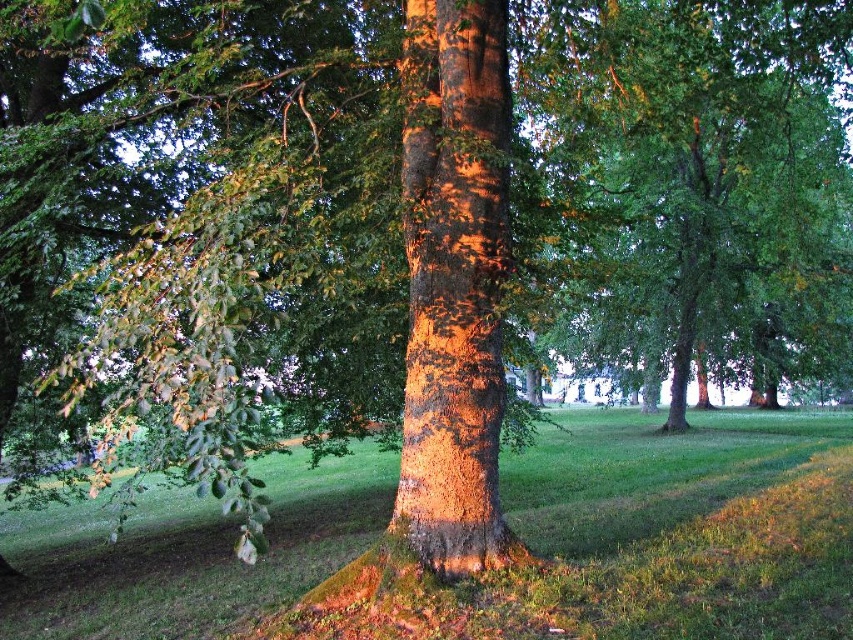
In the scene shown: You are a bird looking for a place to perch. You see the green leafy tree at center and the shiny brown bark at center. Which one has a bigger area to land on?

The green leafy tree at center is larger in size than the shiny brown bark at center, so it has a bigger area to land on.